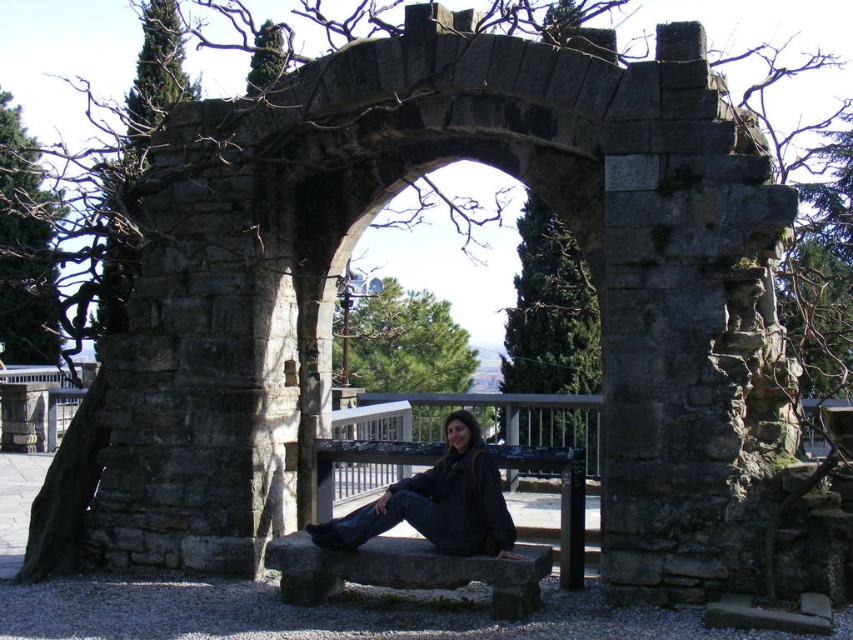
Question: Which of the following is the closest to the observer?

Choices:
 (A) (578, 538)
 (B) (380, 554)

Answer: (B)

Question: Is gray stone bench at center closer to camera compared to dark gray stone bench at center?

Choices:
 (A) no
 (B) yes

Answer: (B)

Question: Which point is closer to the camera taking this photo?

Choices:
 (A) click(x=428, y=573)
 (B) click(x=312, y=448)

Answer: (A)

Question: Is gray stone bench at center above dark gray stone bench at center?

Choices:
 (A) no
 (B) yes

Answer: (A)

Question: Observing the image, what is the correct spatial positioning of gray stone bench at center in reference to dark gray stone bench at center?

Choices:
 (A) left
 (B) right

Answer: (A)

Question: Which point appears closest to the camera in this image?

Choices:
 (A) (393, 582)
 (B) (337, 442)

Answer: (A)